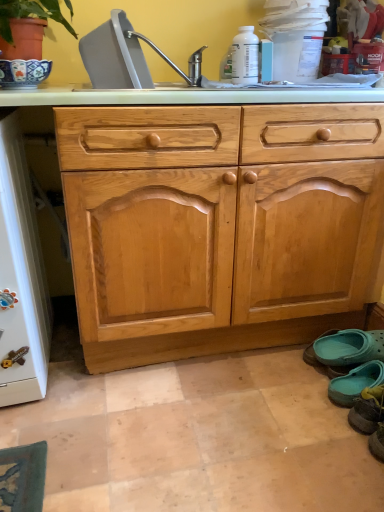
Identify the location of free location above teal rubber clogs at lower right, the third footwear from the front (from a real-world perspective). This screenshot has width=384, height=512. (340, 335).